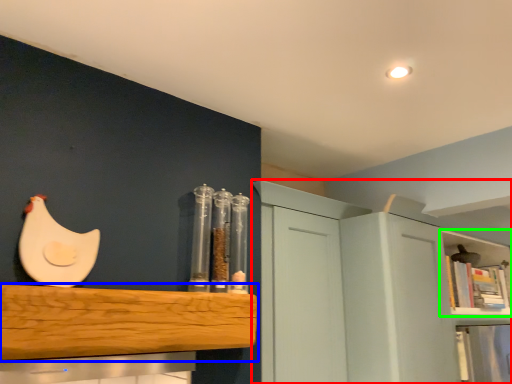
Question: Based on their relative distances, which object is farther from cabinetry (highlighted by a red box)? Choose from shelf (highlighted by a blue box) and shelf (highlighted by a green box).

Choices:
 (A) shelf
 (B) shelf

Answer: (B)